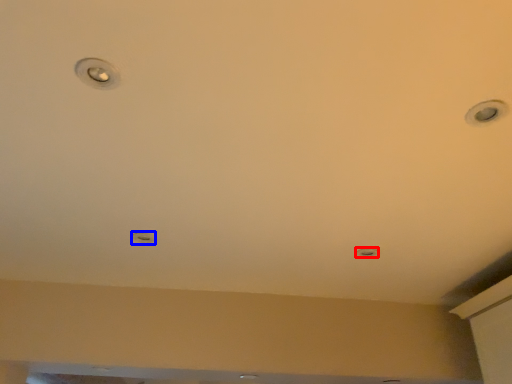
Question: Which object is closer to the camera taking this photo, light (highlighted by a red box) or droplight (highlighted by a blue box)?

Choices:
 (A) light
 (B) droplight

Answer: (B)